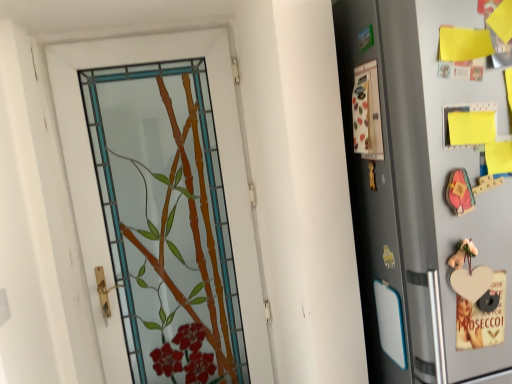
Question: Should I look upward or downward to see matte plastic screen door at right?

Choices:
 (A) down
 (B) up

Answer: (A)

Question: Could you tell me if matte plastic screen door at right is turned towards silver metallic refrigerator at right?

Choices:
 (A) yes
 (B) no

Answer: (A)

Question: From a real-world perspective, is matte plastic screen door at right physically below silver metallic refrigerator at right?

Choices:
 (A) yes
 (B) no

Answer: (B)

Question: Can you confirm if matte plastic screen door at right is positioned to the left of silver metallic refrigerator at right?

Choices:
 (A) yes
 (B) no

Answer: (A)

Question: Considering the relative sizes of matte plastic screen door at right and silver metallic refrigerator at right in the image provided, is matte plastic screen door at right shorter than silver metallic refrigerator at right?

Choices:
 (A) no
 (B) yes

Answer: (B)

Question: Are matte plastic screen door at right and silver metallic refrigerator at right making contact?

Choices:
 (A) no
 (B) yes

Answer: (B)

Question: Is silver metallic refrigerator at right located within matte plastic screen door at right?

Choices:
 (A) no
 (B) yes

Answer: (A)

Question: Is silver metallic refrigerator at right looking in the opposite direction of matte plastic screen door at right?

Choices:
 (A) no
 (B) yes

Answer: (A)

Question: From the image's perspective, is silver metallic refrigerator at right beneath matte plastic screen door at right?

Choices:
 (A) yes
 (B) no

Answer: (A)

Question: Considering the relative positions of silver metallic refrigerator at right and matte plastic screen door at right in the image provided, is silver metallic refrigerator at right to the left of matte plastic screen door at right from the viewer's perspective?

Choices:
 (A) no
 (B) yes

Answer: (A)

Question: Is silver metallic refrigerator at right outside of matte plastic screen door at right?

Choices:
 (A) yes
 (B) no

Answer: (A)

Question: Is silver metallic refrigerator at right bigger than matte plastic screen door at right?

Choices:
 (A) yes
 (B) no

Answer: (A)

Question: Is silver metallic refrigerator at right shorter than matte plastic screen door at right?

Choices:
 (A) no
 (B) yes

Answer: (A)

Question: Is silver metallic refrigerator at right at the right side of stained glass door at center?

Choices:
 (A) yes
 (B) no

Answer: (A)